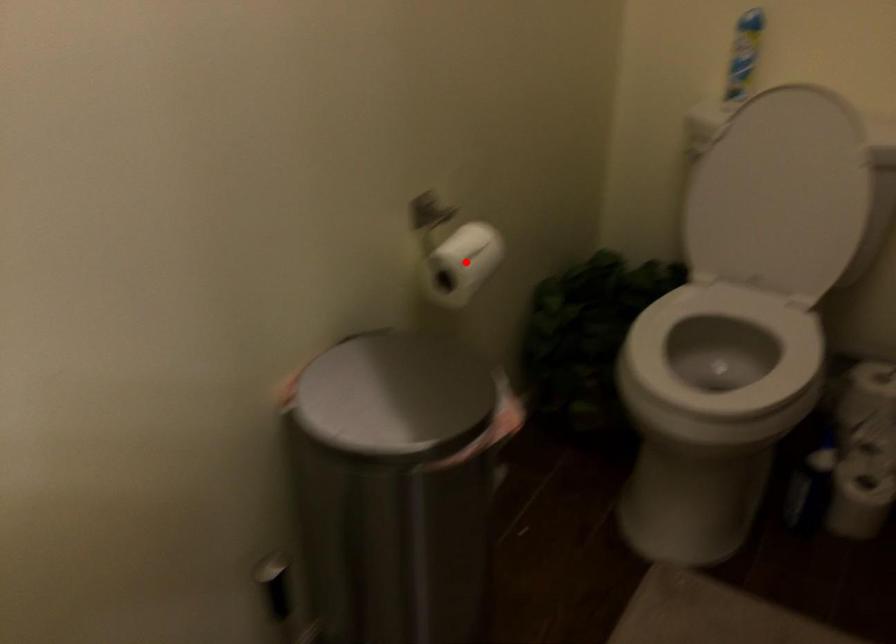
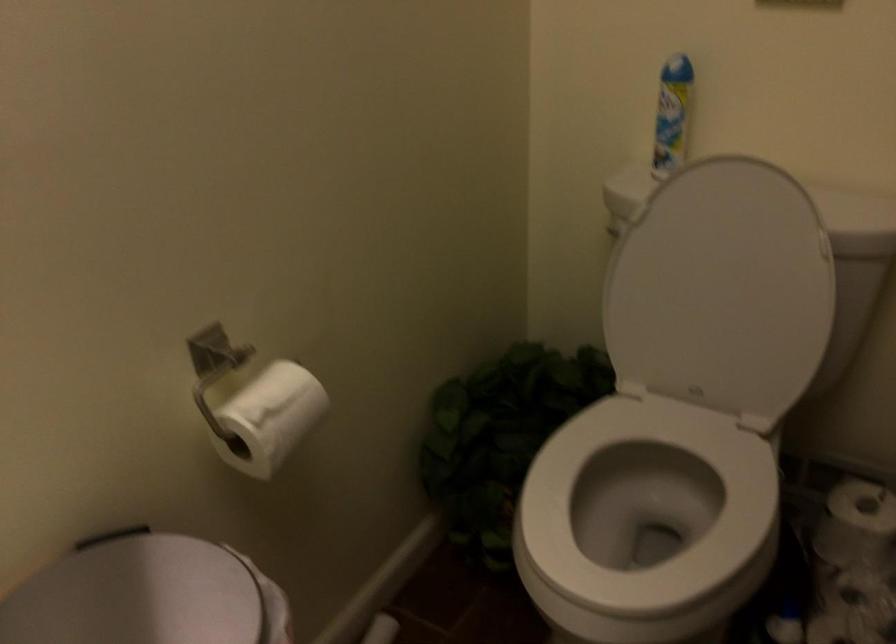
Question: I am providing you with two images of the same scene from different viewpoints. Image1 has a red point marked. In image2, the corresponding 3D location appears at what relative position? Reply with the corresponding letter.

Choices:
 (A) Closer
 (B) Farther

Answer: (A)